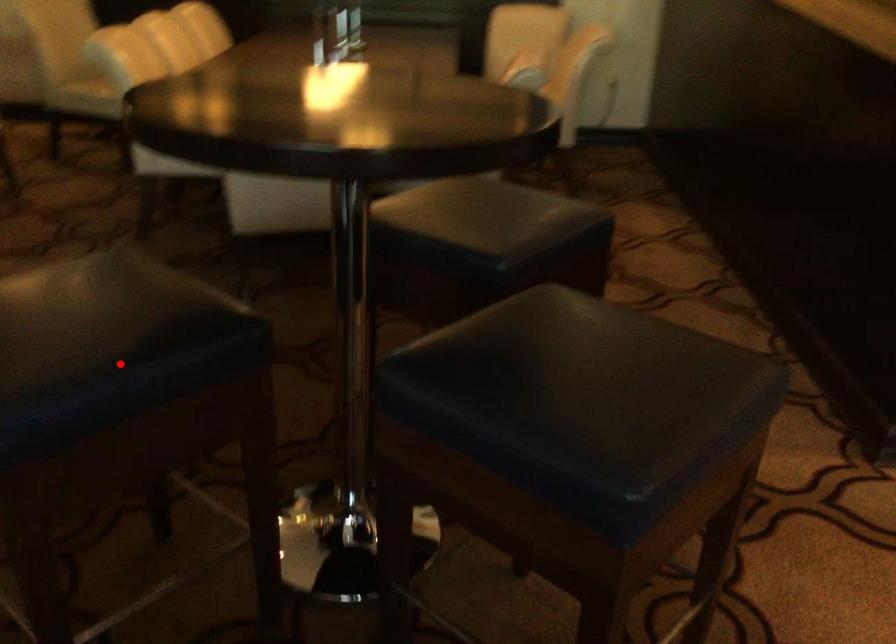
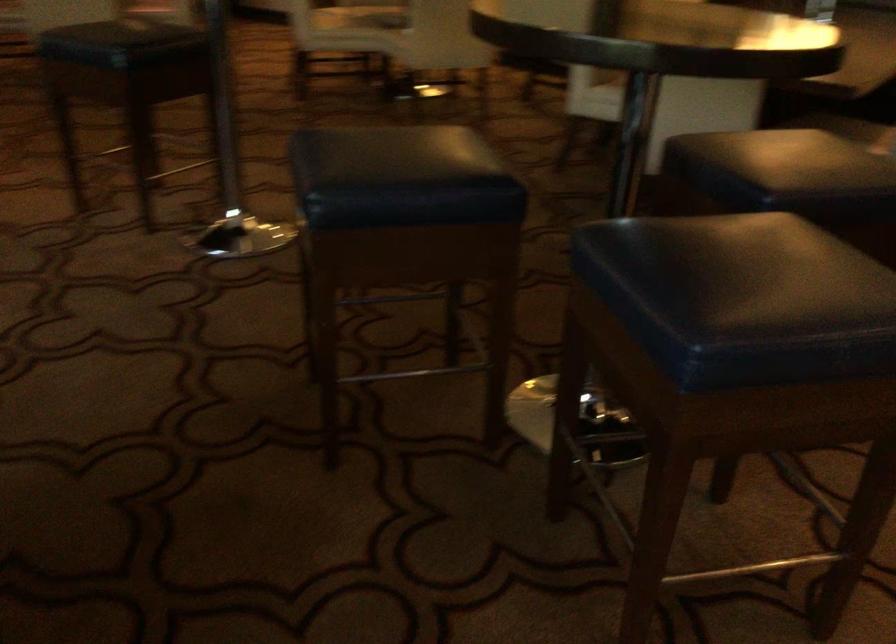
In the second image, find the point that corresponds to the highlighted location in the first image.

(401, 178)